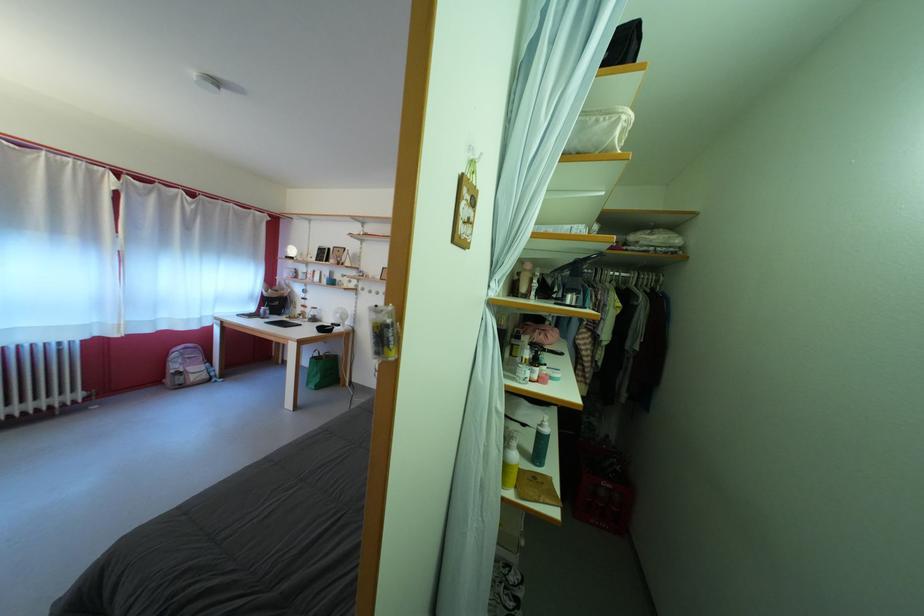
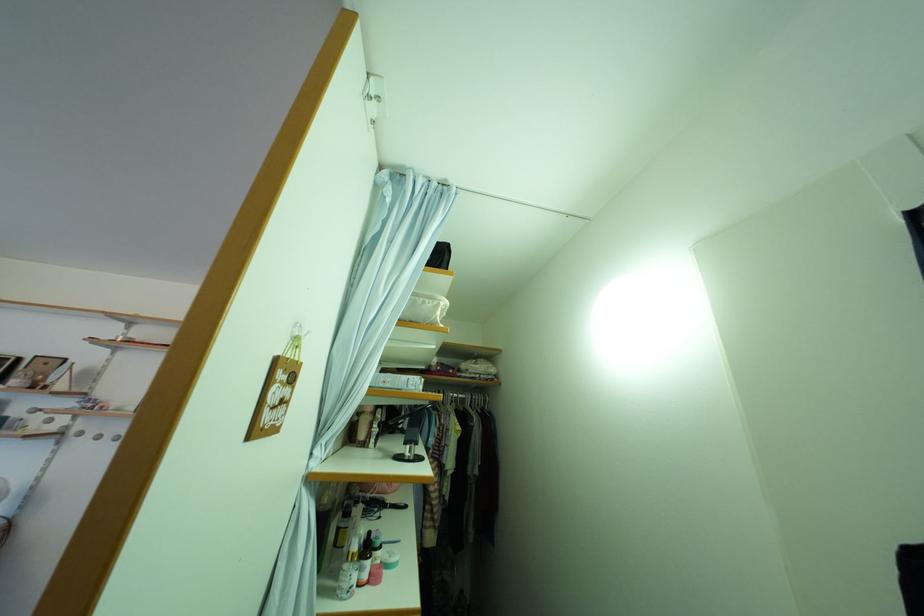
Locate, in the second image, the point that corresponds to [553,371] in the first image.

(390, 554)